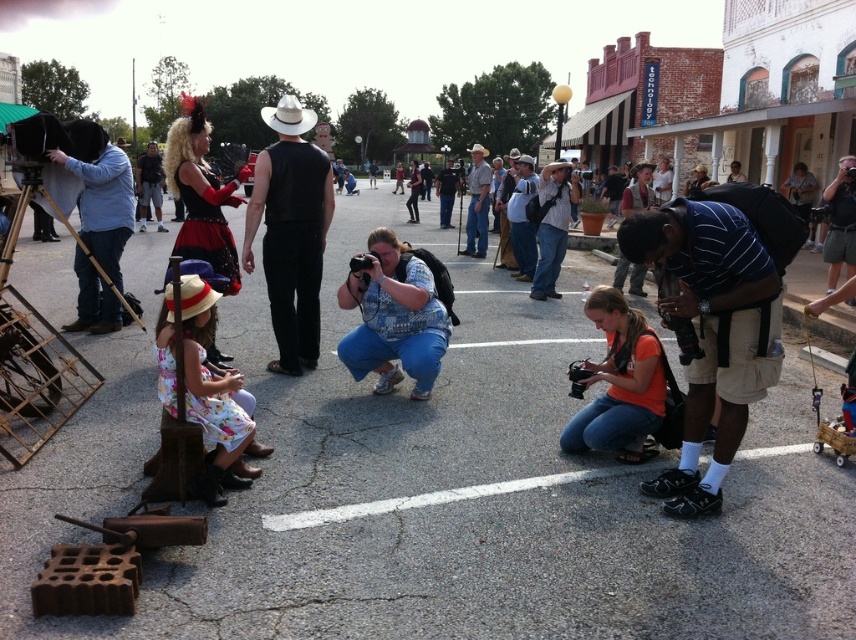
You are a photographer in the town square and need to adjust your equipment. You see the striped cotton shirt at lower right and the denim jeans at center. Which item is closer to the ground?

The striped cotton shirt at lower right is positioned under denim jeans at center, so it is closer to the ground.

You are a photographer at the event and want to capture a clear shot of both the striped cotton shirt at lower right and the denim jeans at center. Since you can only focus on one subject at a time, which one should you focus on to ensure the other is still in the background?

You should focus on the striped cotton shirt at lower right because it is in front of the denim jeans at center, so the denim jeans at center will be in the background.